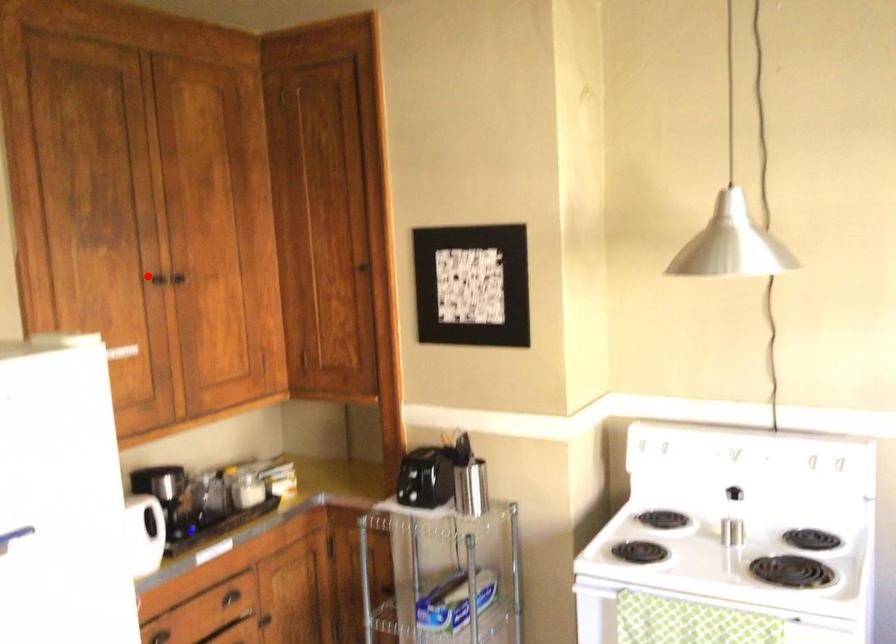
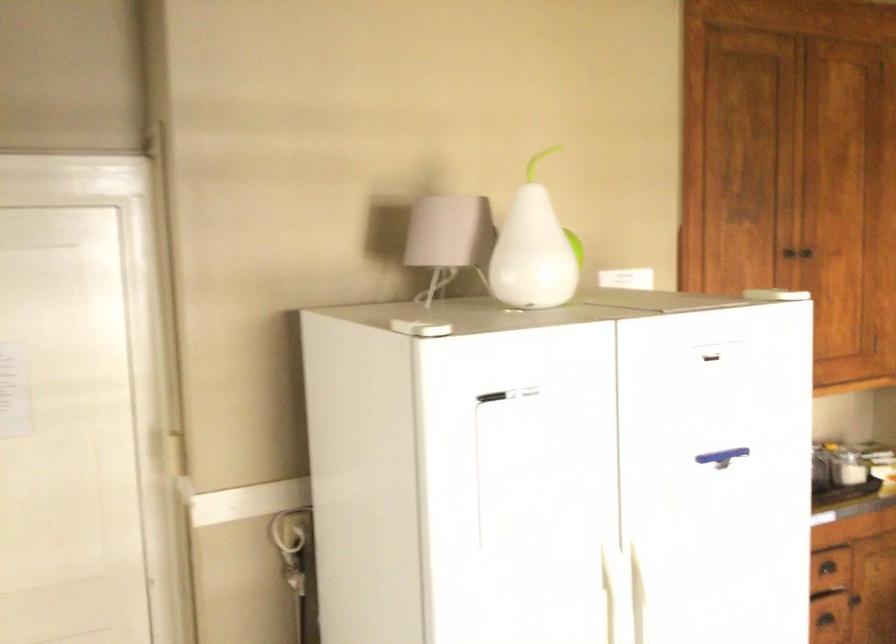
The point at the highlighted location is marked in the first image. Where is the corresponding point in the second image?

(786, 257)